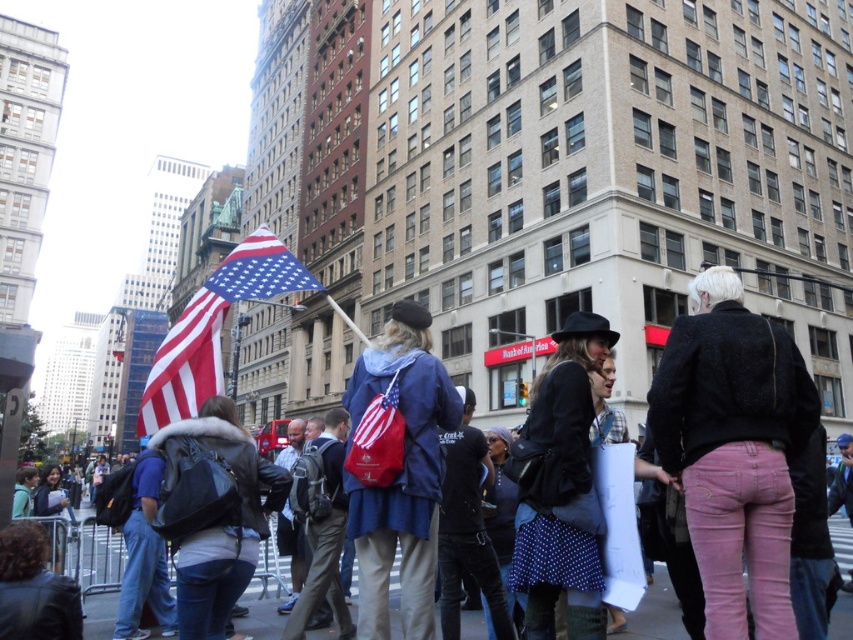
Question: Can you confirm if american flag at center is positioned above blue denim jacket at center?

Choices:
 (A) no
 (B) yes

Answer: (B)

Question: Can you confirm if american flag at center is wider than blue denim jacket at center?

Choices:
 (A) yes
 (B) no

Answer: (B)

Question: Does american flag at center appear over blue denim jacket at center?

Choices:
 (A) no
 (B) yes

Answer: (B)

Question: Which object is closer to the camera taking this photo?

Choices:
 (A) american flag at center
 (B) blue denim jacket at center

Answer: (B)

Question: Which of the following is the closest to the observer?

Choices:
 (A) american flag at center
 (B) blue denim jacket at center

Answer: (B)

Question: Which point is closer to the camera?

Choices:
 (A) (263, 612)
 (B) (292, 282)

Answer: (A)